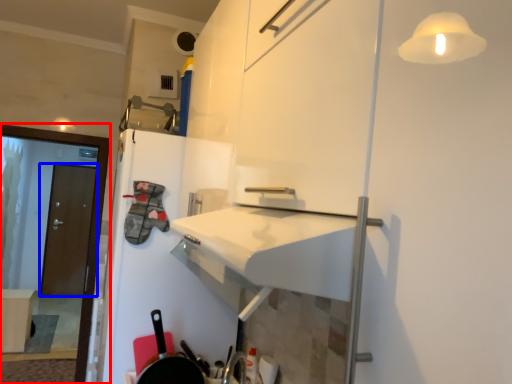
Question: Which point is further to the camera, screen door (highlighted by a red box) or door (highlighted by a blue box)?

Choices:
 (A) screen door
 (B) door

Answer: (B)